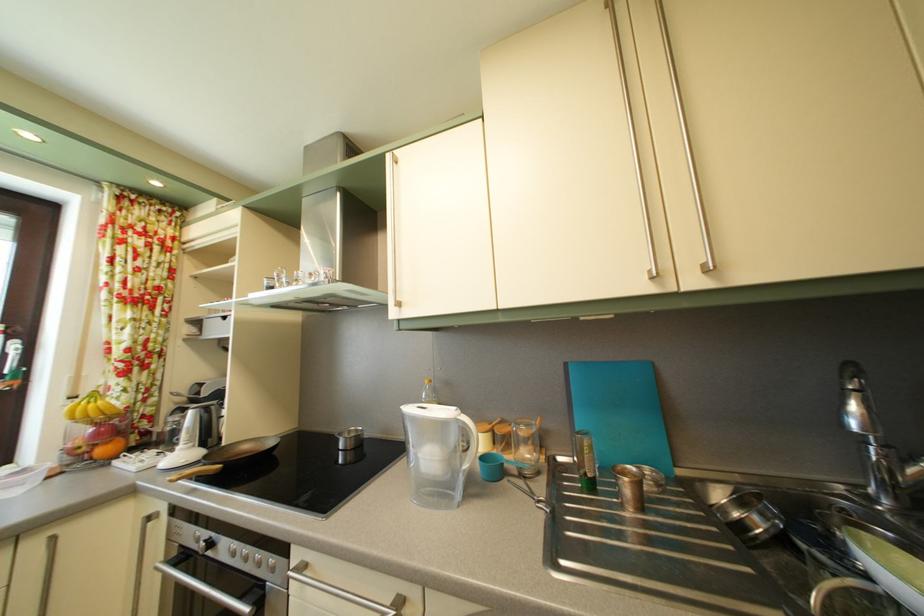
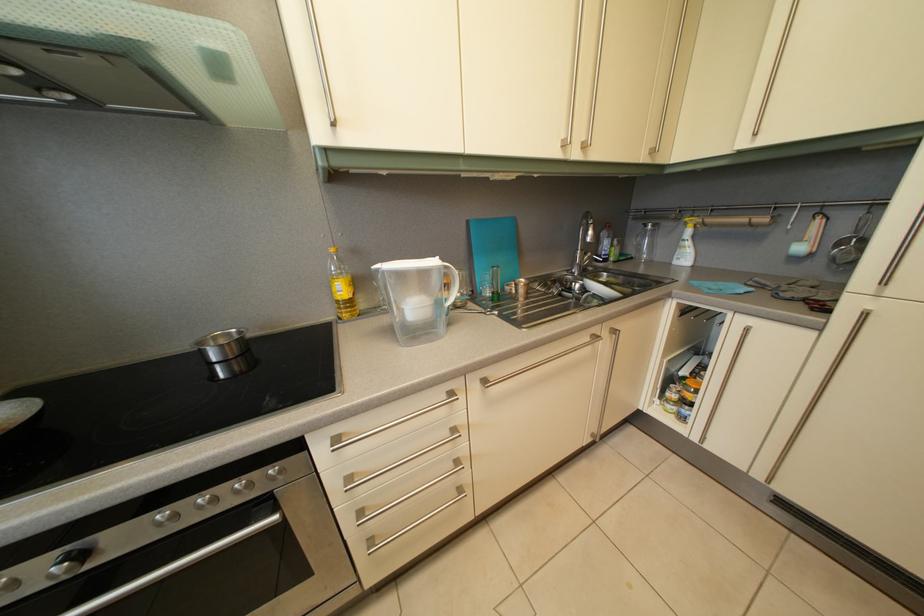
In the second image, find the point that corresponds to point (254, 557) in the first image.

(211, 505)